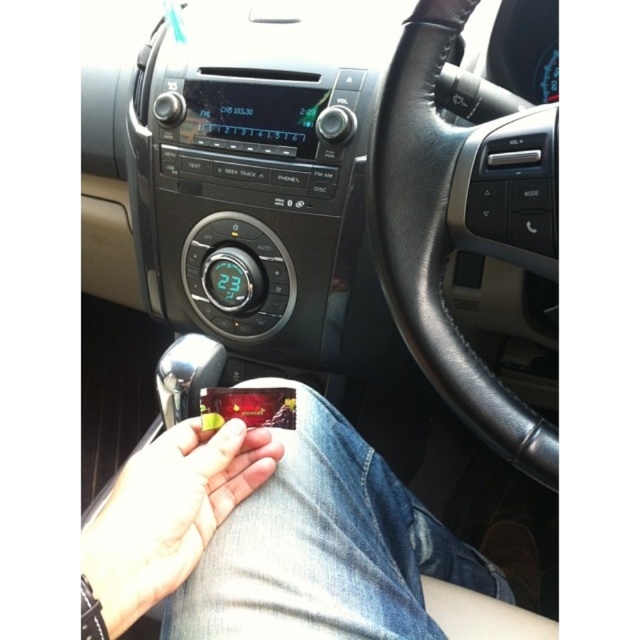
You are a driver who wants to reach the matte plastic candy at lower center while keeping your hands on the matte black steering wheel at center. Can you do this without moving your hands from the steering wheel?

The matte black steering wheel at center is 7.37 inches from the matte plastic candy at lower center. Since this distance is relatively short, it might be possible to reach the candy without moving your hands from the steering wheel, depending on the driver s arm length and flexibility.

You are a passenger in the car and want to grab the matte plastic candy at lower center. Which side of the matte black steering wheel at center should you reach towards?

The matte plastic candy at lower center is to the left of the matte black steering wheel at center, so you should reach towards the left side of the matte black steering wheel at center.